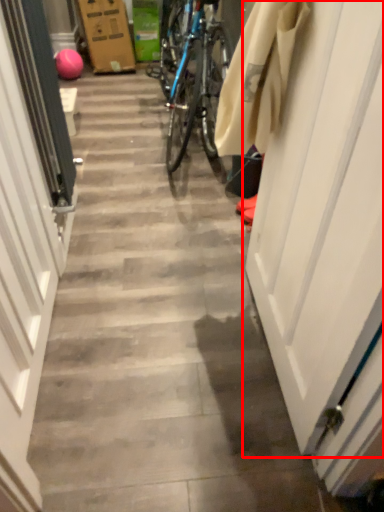
Question: From the image, what is the correct spatial relationship of door (annotated by the red box) in relation to door?

Choices:
 (A) right
 (B) left

Answer: (A)